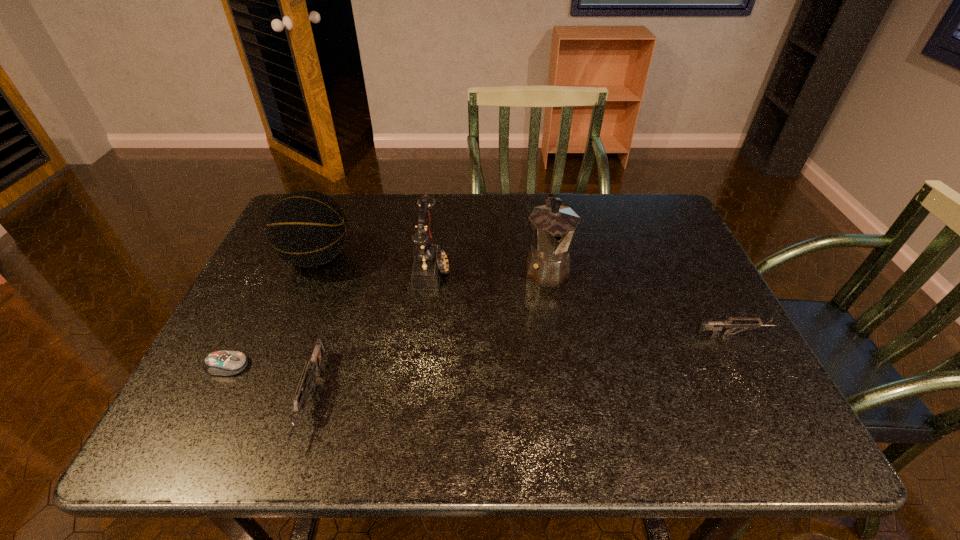
You are a GUI agent. You are given a task and a screenshot of the screen. Output one action in this format:
    pyautogui.click(x=<x>, y=<y>)
    Task: Click on the free region at the far edge of the desktop
    The height and width of the screenshot is (540, 960).
    Given the screenshot: What is the action you would take?
    pyautogui.click(x=612, y=212)

Locate an element on the screen. Image resolution: width=960 pixels, height=540 pixels. blank space at the near edge of the desktop is located at coordinates (565, 376).

Identify the location of free space at the left edge. This screenshot has width=960, height=540. (285, 342).

Locate an element on the screen. This screenshot has width=960, height=540. free space at the right edge of the desktop is located at coordinates (728, 367).

At what (x,y) coordinates should I click in order to perform the action: click on free location at the near left corner. Please return your answer as a coordinate pair (x, y). This screenshot has height=540, width=960. Looking at the image, I should click on (272, 372).

Find the location of a particular element. This screenshot has height=540, width=960. free point at the far right corner is located at coordinates (645, 210).

Find the location of `vacant space that's between the telephone and the coffeepot`. vacant space that's between the telephone and the coffeepot is located at coordinates [490, 268].

I want to click on free space between the farther gun and the nearer gun, so click(x=523, y=366).

I want to click on vacant area between the third object from right to left and the taller gun, so click(372, 333).

Image resolution: width=960 pixels, height=540 pixels. What are the coordinates of `vacant area between the telephone and the basketball` in the screenshot? It's located at (374, 263).